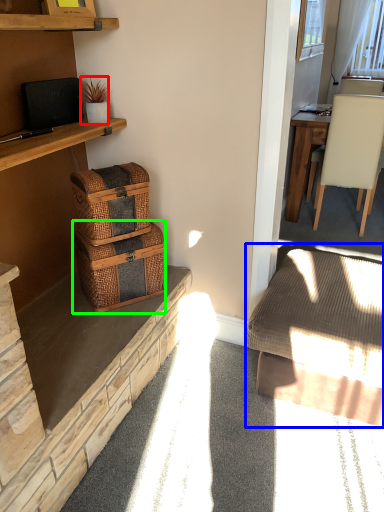
Question: Based on their relative distances, which object is nearer to houseplant (highlighted by a red box)? Choose from studio couch (highlighted by a blue box) and picnic basket (highlighted by a green box).

Choices:
 (A) studio couch
 (B) picnic basket

Answer: (B)